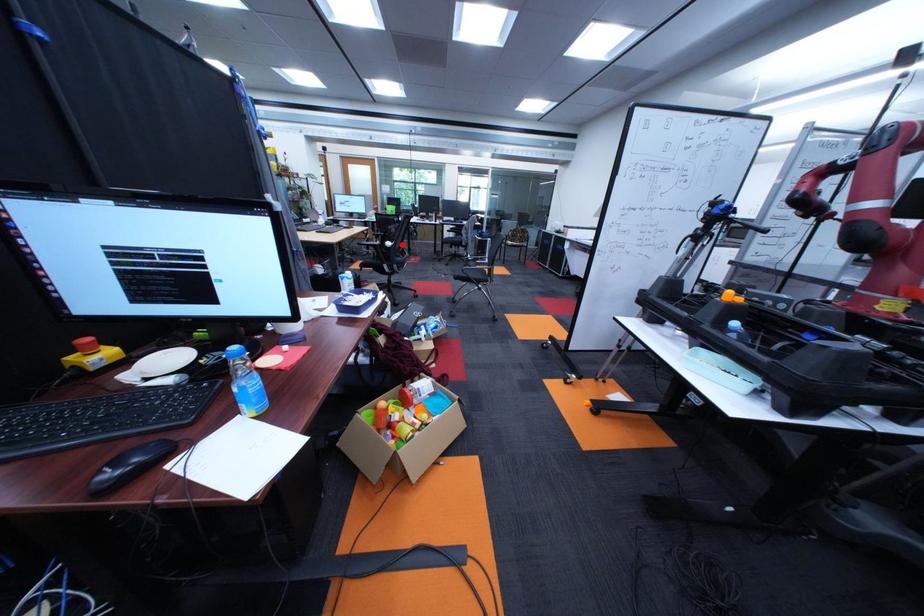
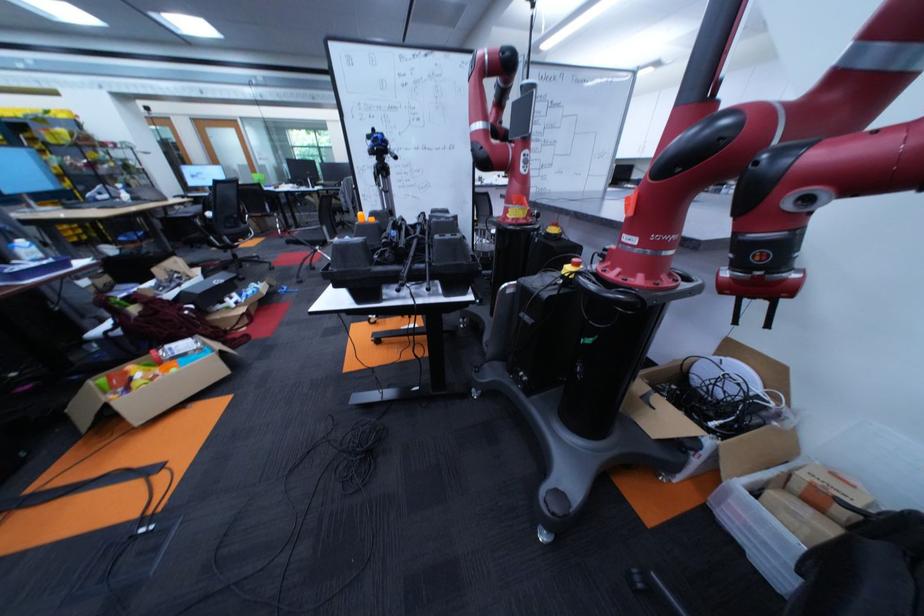
The point at the highlighted location is marked in the first image. Where is the corresponding point in the second image?

(224, 215)